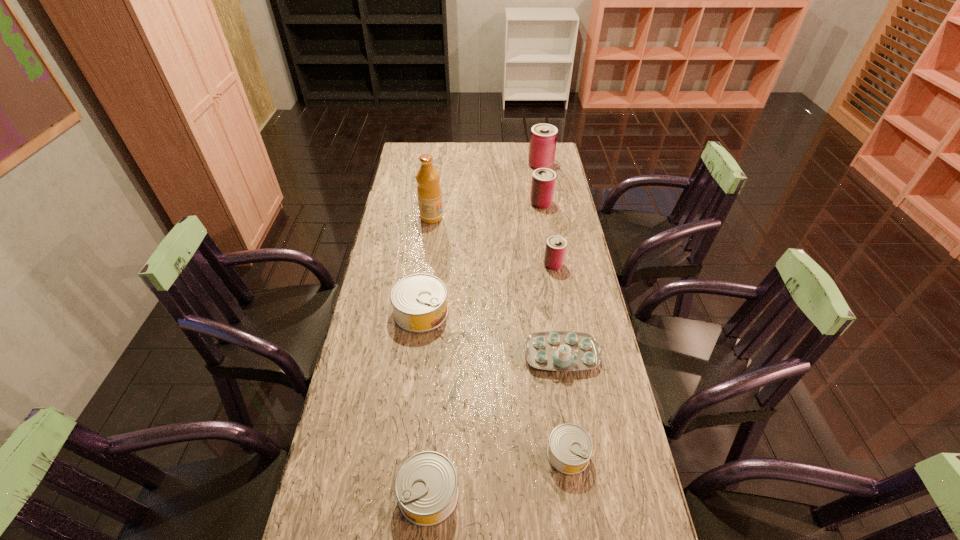
This screenshot has width=960, height=540. What are the coordinates of `free space that satisfies the following two spatial constraints: 1. on the front label of the farthest silver can; 2. on the right side of the sixth nearest object` in the screenshot? It's located at [x=420, y=312].

The image size is (960, 540). I want to click on vacant area that satisfies the following two spatial constraints: 1. on the back side of the smallest pink can; 2. on the left side of the second smallest silver can, so click(446, 265).